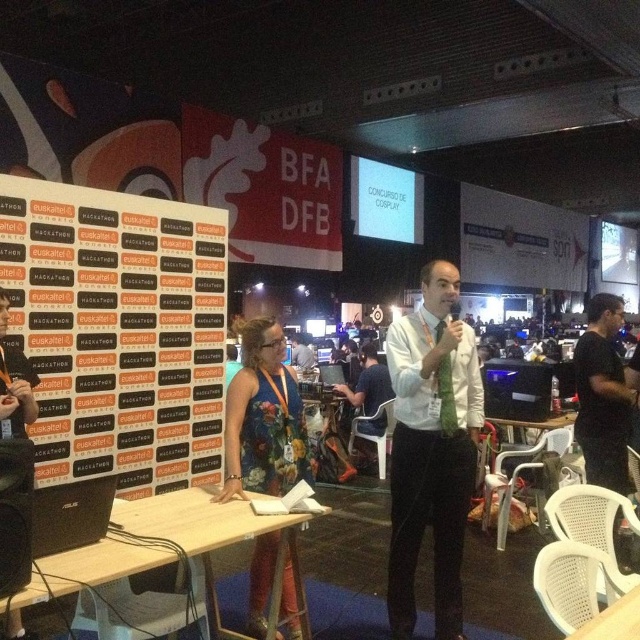
Which is more to the left, white paperboard at left or floral dress at center?

white paperboard at left

Does white paperboard at left have a greater height compared to floral dress at center?

Yes, white paperboard at left is taller than floral dress at center.

Is point (212, 452) more distant than point (252, 320)?

Yes, point (212, 452) is farther from viewer.

This screenshot has width=640, height=640. What are the coordinates of `white paperboard at left` in the screenshot? It's located at (118, 332).

Who is more forward, (148, 328) or (358, 394)?

Point (148, 328) is more forward.

Locate an element on the screen. The image size is (640, 640). white paperboard at left is located at coordinates (118, 332).

Which of these two, white glossy shirt at center or white shirt at center, stands taller?

Standing taller between the two is white glossy shirt at center.

Does white glossy shirt at center appear over white shirt at center?

Yes, white glossy shirt at center is above white shirt at center.

Between point (390, 372) and point (376, 436), which one is positioned in front?

Point (390, 372) is in front.

Where is `white glossy shirt at center`? The image size is (640, 640). white glossy shirt at center is located at coordinates (432, 449).